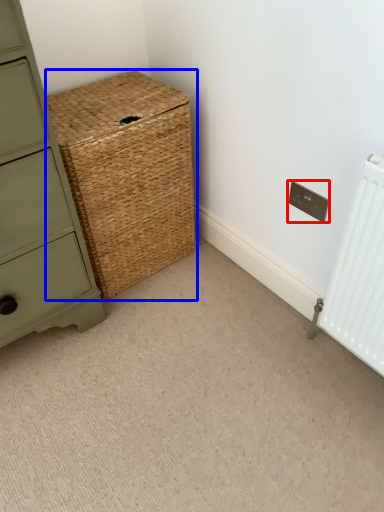
Question: Which of the following is the farthest to the observer, electric outlet (highlighted by a red box) or basket (highlighted by a blue box)?

Choices:
 (A) electric outlet
 (B) basket

Answer: (A)